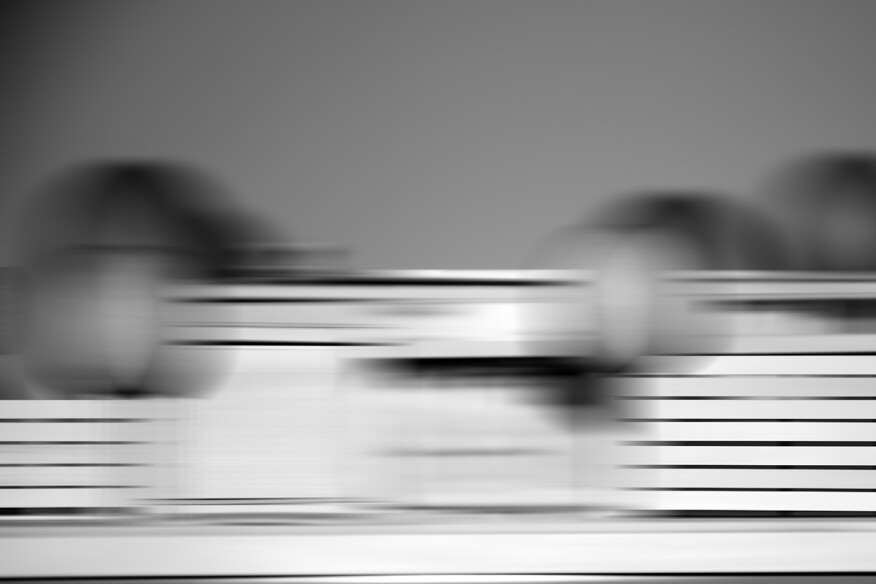
Where is `corner`? This screenshot has width=876, height=584. corner is located at coordinates (x=48, y=22).